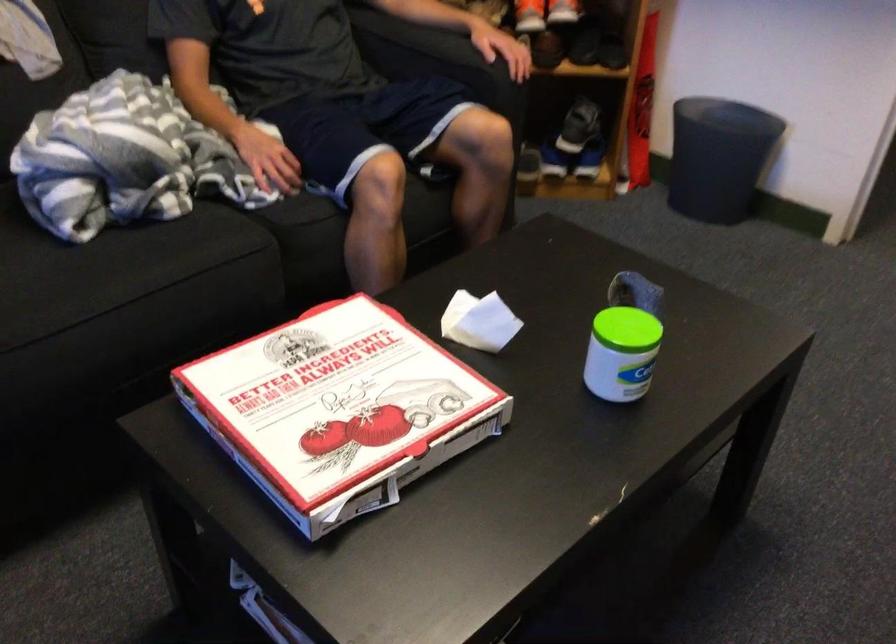
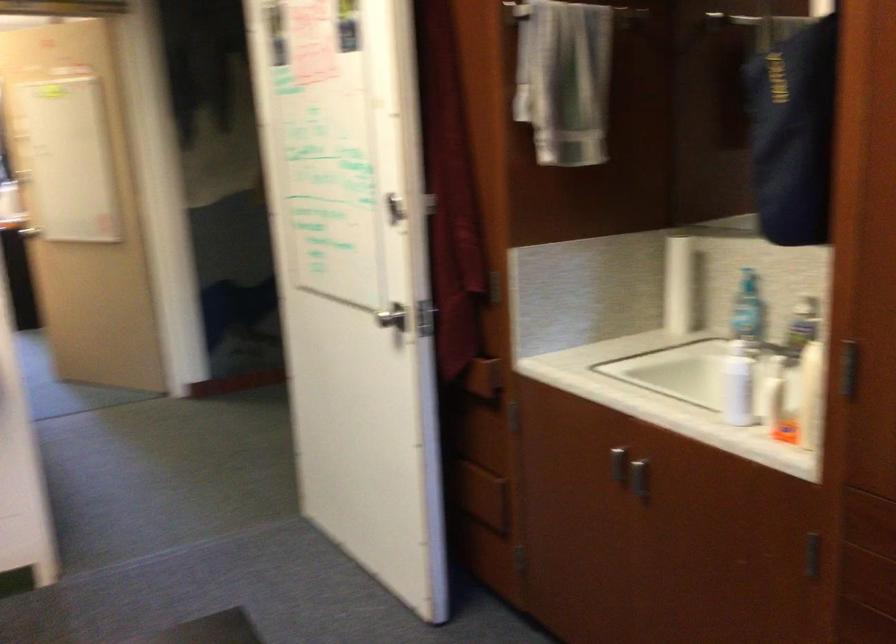
Question: The images are taken continuously from a first-person perspective. In which direction is your viewpoint rotating?

Choices:
 (A) Left
 (B) Right
 (C) Up
 (D) Down

Answer: (B)